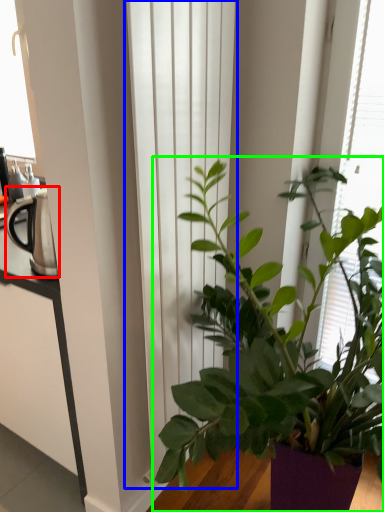
Question: Which object is positioned closest to appliance (highlighted by a red box)? Select from curtain (highlighted by a blue box) and houseplant (highlighted by a green box).

Choices:
 (A) curtain
 (B) houseplant

Answer: (A)